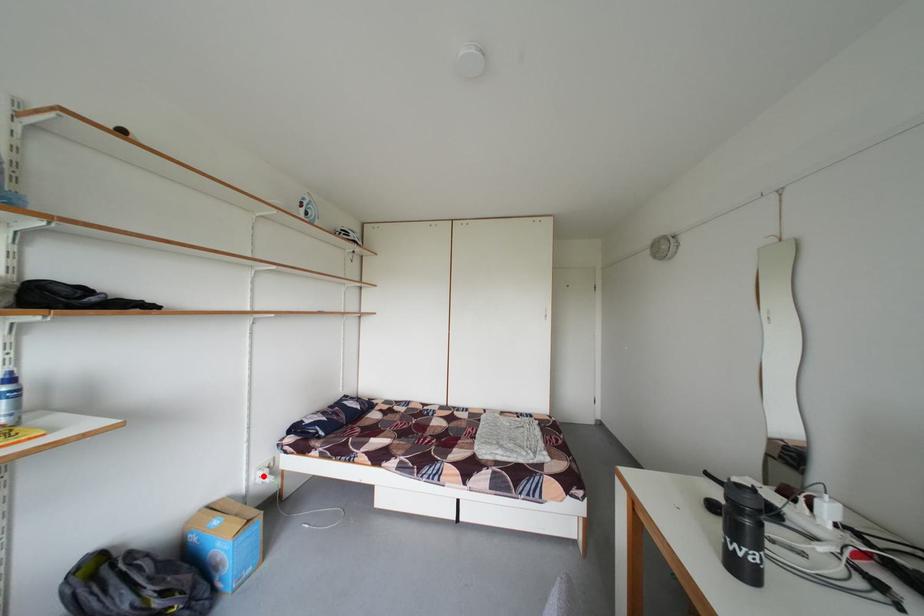
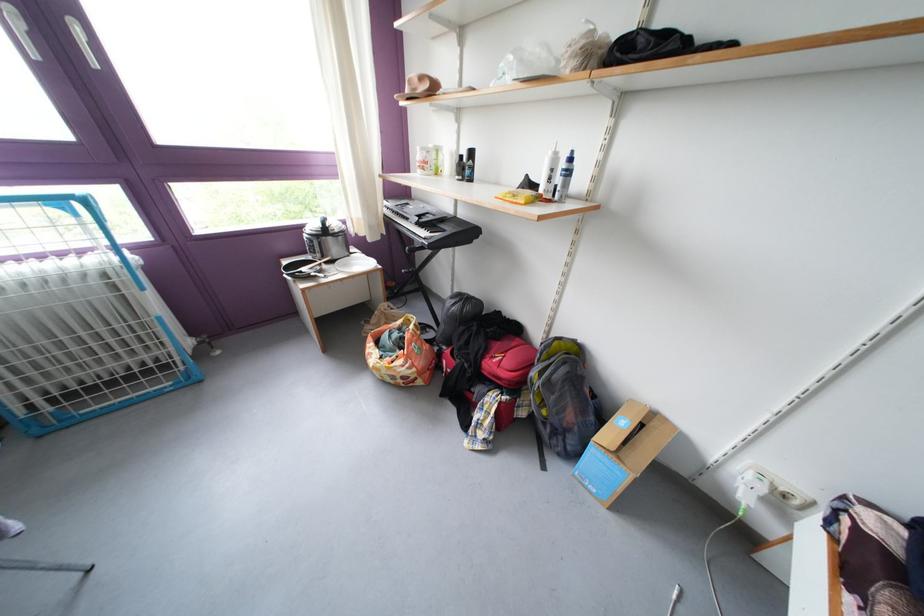
The point at the highlighted location is marked in the first image. Where is the corresponding point in the second image?

(758, 467)